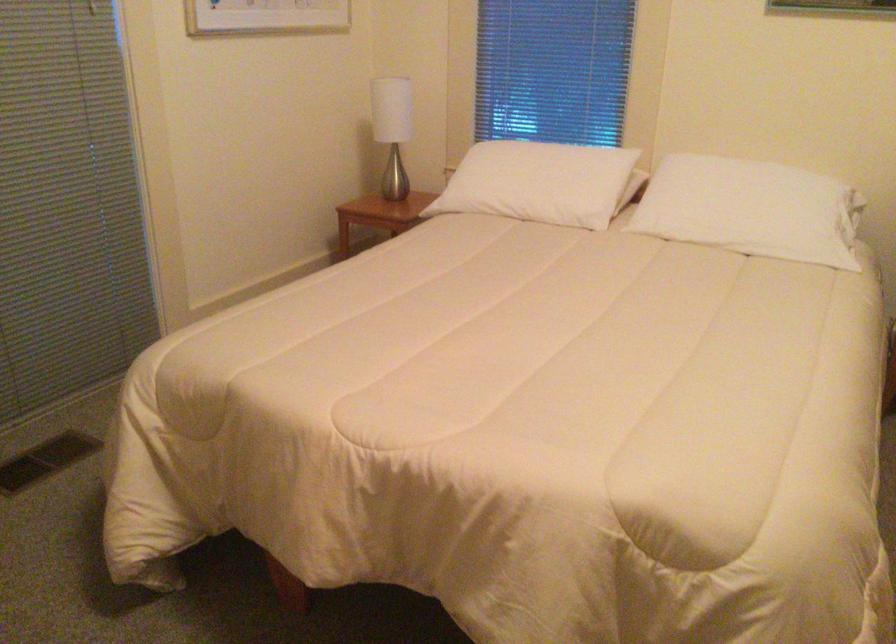
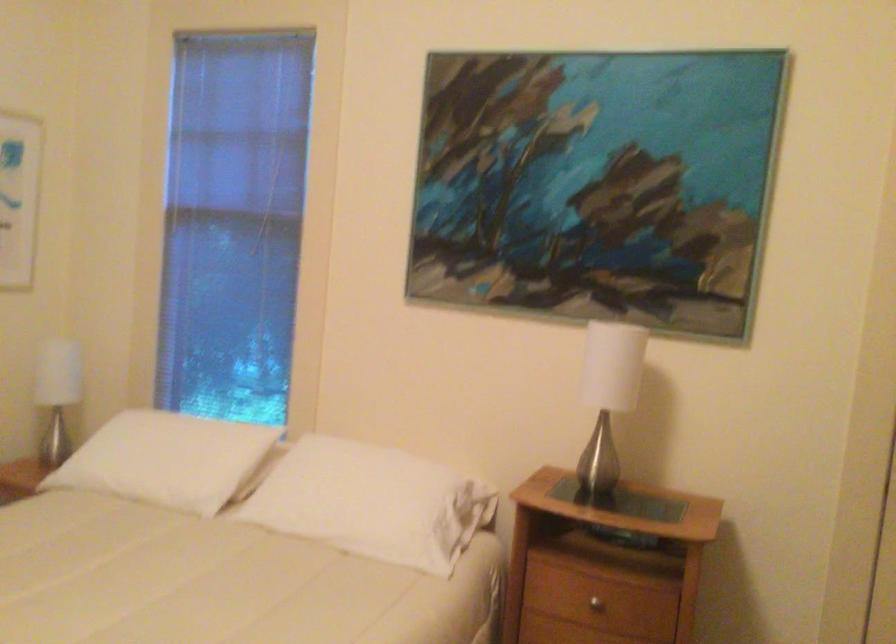
Find the pixel in the second image that matches point 769,200 in the first image.

(373, 502)